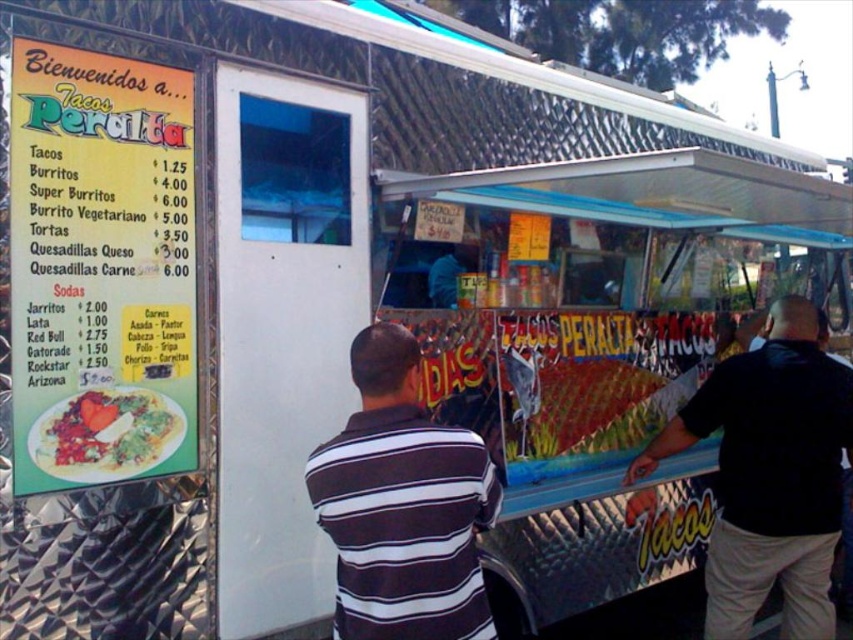
Question: Which of the following is the closest to the observer?

Choices:
 (A) striped polo shirt at center
 (B) black matte shirt at right
 (C) vibrant plastic plate at left
 (D) green paper menu at upper left

Answer: (A)

Question: In this image, where is green paper menu at upper left located relative to striped polo shirt at center?

Choices:
 (A) left
 (B) right

Answer: (A)

Question: Is black matte shirt at right further to camera compared to vibrant plastic plate at left?

Choices:
 (A) yes
 (B) no

Answer: (A)

Question: Which point is farther to the camera?

Choices:
 (A) black matte shirt at right
 (B) striped polo shirt at center
 (C) green paper menu at upper left

Answer: (A)

Question: Among these points, which one is farthest from the camera?

Choices:
 (A) (171, 348)
 (B) (749, 541)

Answer: (B)

Question: Where is striped polo shirt at center located in relation to vibrant plastic plate at left in the image?

Choices:
 (A) right
 (B) left

Answer: (A)